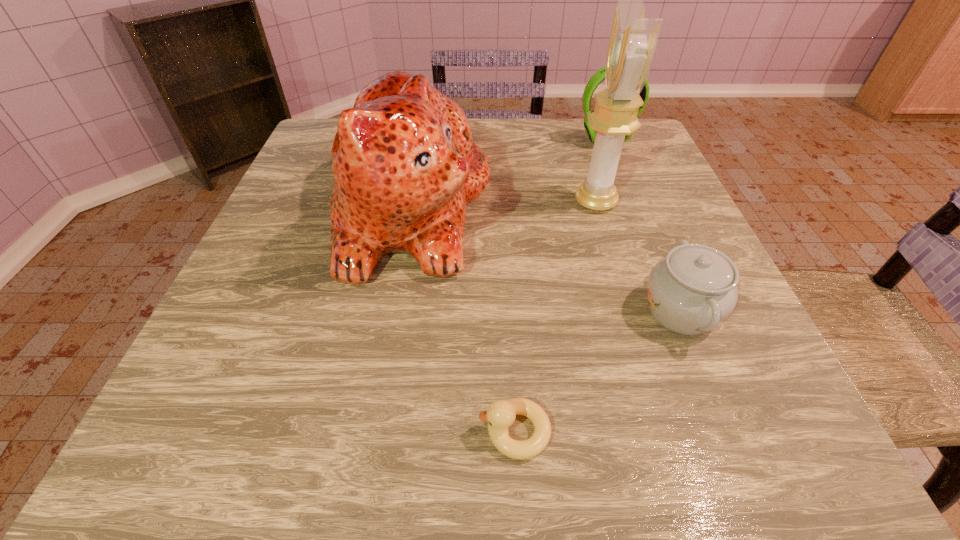
At what (x,y) coordinates should I click in order to perform the action: click on vacant point located 0.210m on the front of the third shortest object. Please return your answer as a coordinate pair (x, y). The height and width of the screenshot is (540, 960). Looking at the image, I should click on (629, 201).

Locate an element on the screen. This screenshot has height=540, width=960. free location located 0.360m on the back of the fourth tallest object is located at coordinates (622, 167).

Where is `vacant space located at the beak of the shortest object`? Image resolution: width=960 pixels, height=540 pixels. vacant space located at the beak of the shortest object is located at coordinates (324, 431).

Identify the location of free space located 0.220m at the beak of the shortest object. Image resolution: width=960 pixels, height=540 pixels. (318, 431).

Image resolution: width=960 pixels, height=540 pixels. Find the location of `free space located at the beak of the shortest object`. free space located at the beak of the shortest object is located at coordinates (288, 431).

Locate an element on the screen. Image resolution: width=960 pixels, height=540 pixels. cat that is at the far edge is located at coordinates (405, 166).

Locate an element on the screen. This screenshot has height=540, width=960. headset positioned at the far edge is located at coordinates (599, 76).

This screenshot has height=540, width=960. I want to click on object that is at the near edge, so click(x=500, y=415).

Locate an element on the screen. This screenshot has height=540, width=960. object at the left edge is located at coordinates (405, 166).

This screenshot has height=540, width=960. In order to click on award that is positioned at the right edge in this screenshot , I will do `click(633, 38)`.